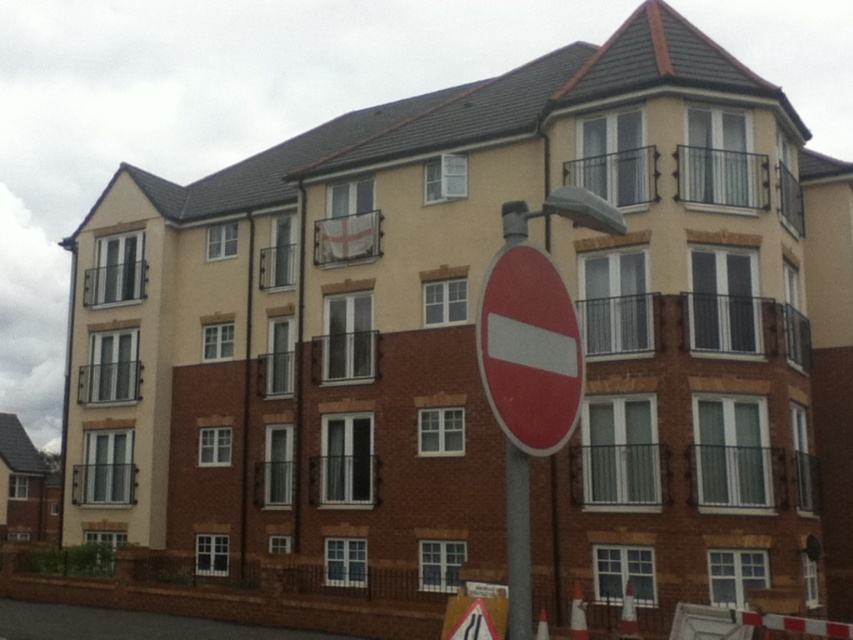
Which is above, red matte sign at center or metallic gray pole at center?

red matte sign at center is above.

Can you confirm if red matte sign at center is thinner than metallic gray pole at center?

Indeed, red matte sign at center has a lesser width compared to metallic gray pole at center.

Who is more forward, (529, 428) or (525, 490)?

Point (529, 428) is in front.

Find the location of a particular element. This screenshot has width=853, height=640. red matte sign at center is located at coordinates (529, 349).